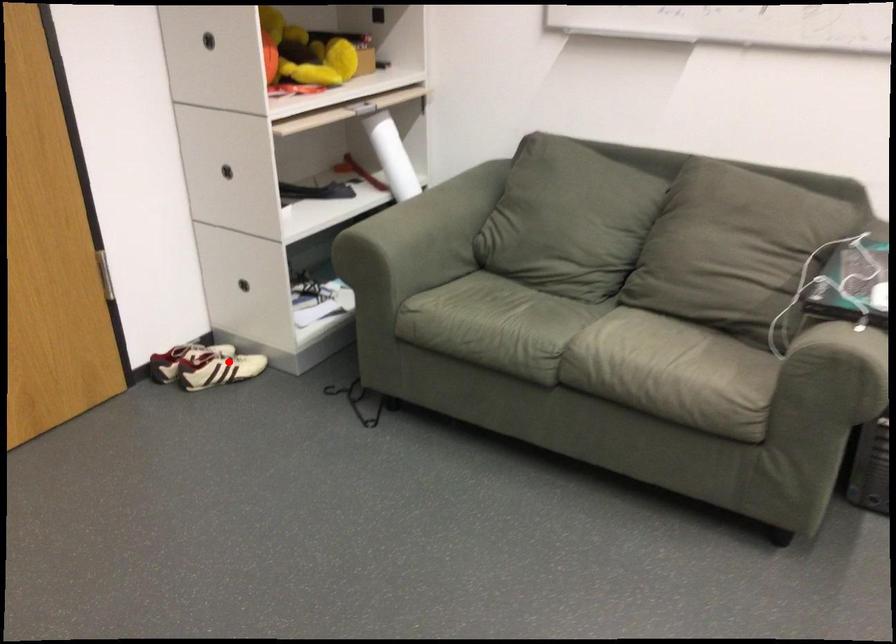
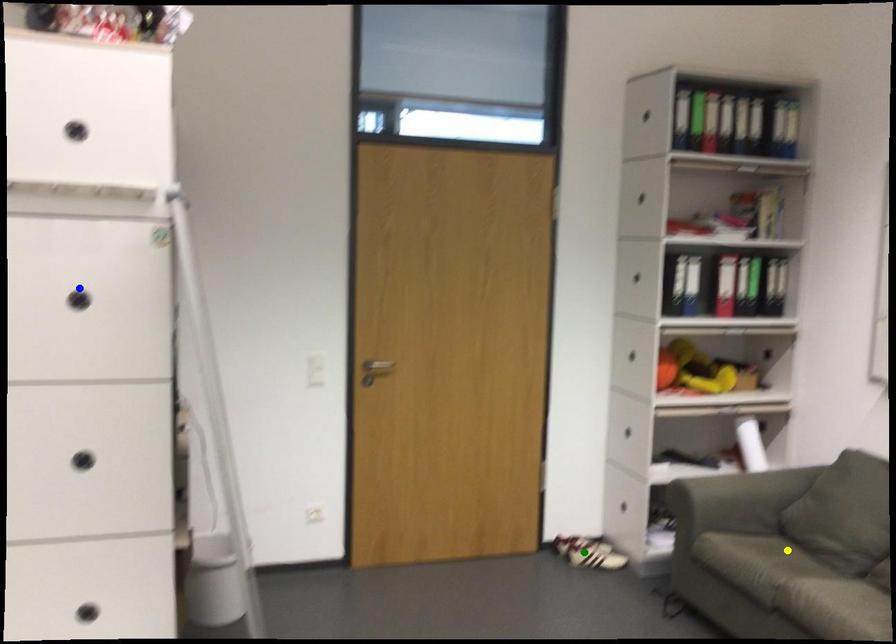
Question: I am providing you with two images of the same scene from different viewpoints. A red point is marked on the first image. You are given multiple points on the second image. In image 2, which mark is for the same physical point as the one in image 1?

Choices:
 (A) green point
 (B) yellow point
 (C) blue point

Answer: (A)